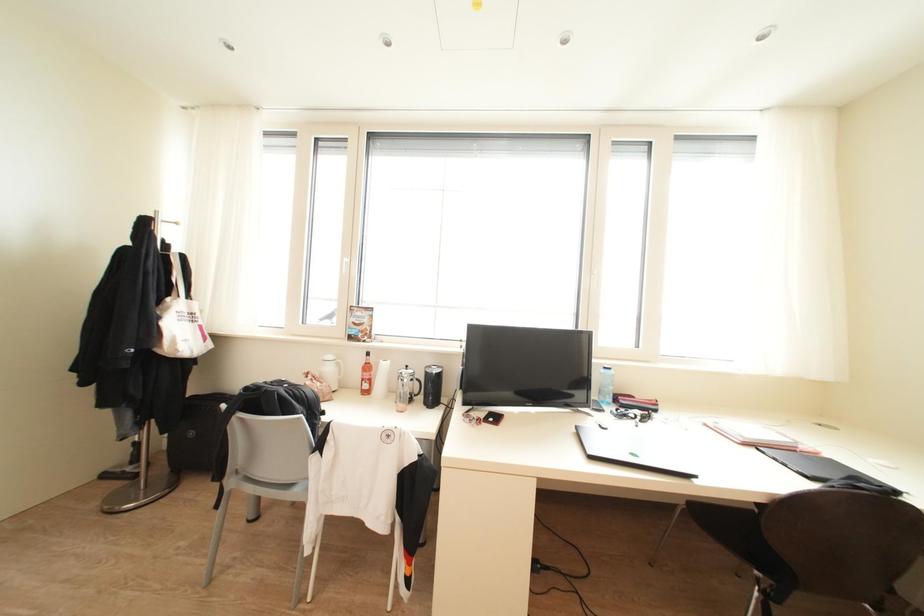
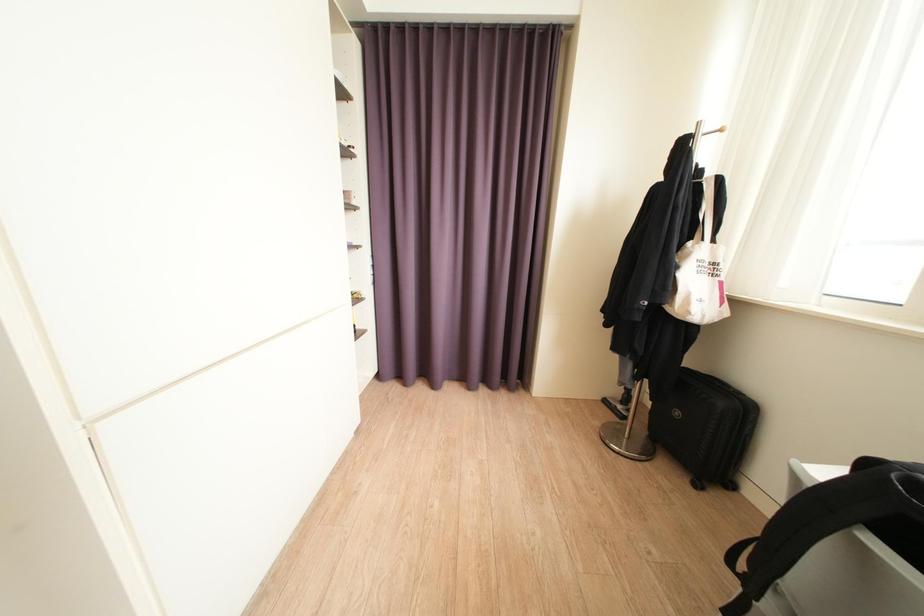
Question: The camera is either moving clockwise (left) or counter-clockwise (right) around the object. The first image is from the beginning of the video and the second image is from the end. Is the camera moving left or right when shooting the video?

Choices:
 (A) Left
 (B) Right

Answer: (B)